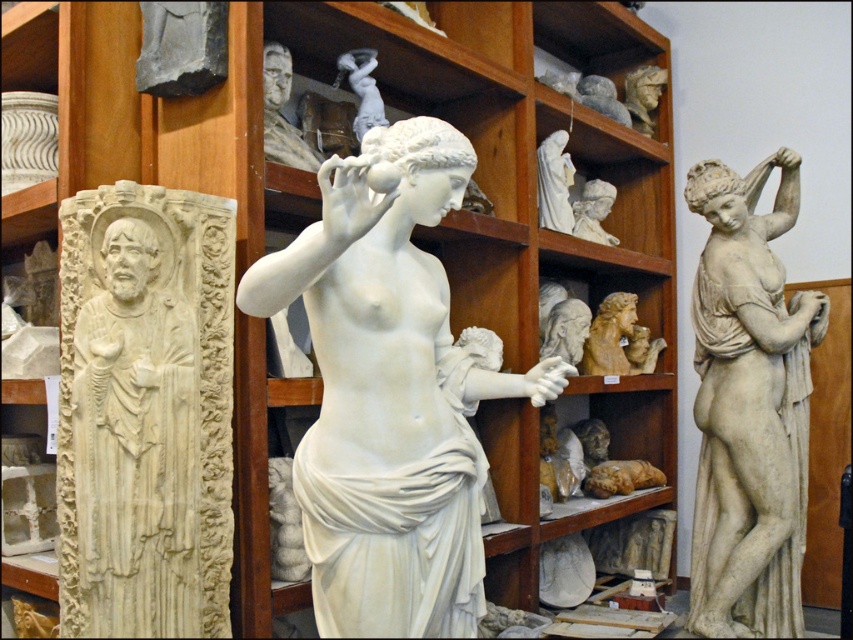
You are an art curator planning to install a new lighting system in the museum. The white marble relief at left and the light brown wood carving at center need to be illuminated. Considering their sizes, which object should have a spotlight placed higher up to properly highlight its height?

The white marble relief at left is much taller than the light brown wood carving at center, so the spotlight should be placed higher above the white marble relief at left to properly highlight its height.

You are an art conservator planning to move the white marble statue at right and the light brown wood carving at center to a new exhibition space. The ceiling height in the new space is 3 meters. Can both objects be safely transported without any modifications?

The white marble statue at right is much taller than the light brown wood carving at center. Since the ceiling height is 3 meters, if the statue exceeds this height, it cannot be transported. However, without specific height measurements, we cannot confirm. Please check the exact dimensions of the white marble statue at right.

You are an art conservator tasked with moving the white marble statue at right and the light brown wood carving at center to a new exhibition space. The transport vehicle has a height limit of 2 meters. Can you determine if both items will fit based on their positions in the current display?

The white marble statue at right is in front of the light brown wood carving at center, but their heights are not specified in the provided information. Therefore, it is impossible to determine if they will fit under the 2 meter height limit without additional measurements.